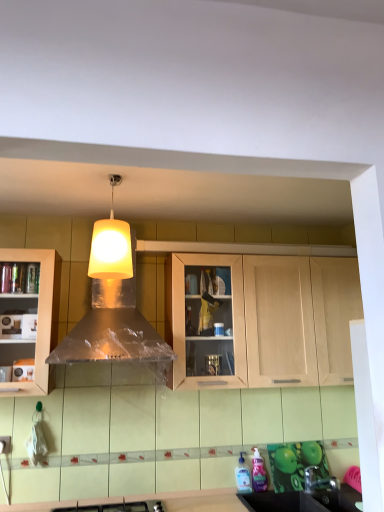
Question: Is light wood cabinet at center looking in the opposite direction of white matte lampshade at upper center?

Choices:
 (A) yes
 (B) no

Answer: (B)

Question: From a real-world perspective, is light wood cabinet at center positioned under white matte lampshade at upper center based on gravity?

Choices:
 (A) no
 (B) yes

Answer: (B)

Question: From the image's perspective, is light wood cabinet at center on white matte lampshade at upper center?

Choices:
 (A) yes
 (B) no

Answer: (B)

Question: Is light wood cabinet at center not near white matte lampshade at upper center?

Choices:
 (A) no
 (B) yes

Answer: (A)

Question: Considering the relative sizes of light wood cabinet at center and white matte lampshade at upper center in the image provided, is light wood cabinet at center wider than white matte lampshade at upper center?

Choices:
 (A) yes
 (B) no

Answer: (A)

Question: Do you think metallic silver hood at center is within black plastic sink at lower right, or outside of it?

Choices:
 (A) outside
 (B) inside

Answer: (A)

Question: From their relative heights in the image, would you say metallic silver hood at center is taller or shorter than black plastic sink at lower right?

Choices:
 (A) short
 (B) tall

Answer: (B)

Question: In terms of width, does metallic silver hood at center look wider or thinner when compared to black plastic sink at lower right?

Choices:
 (A) thin
 (B) wide

Answer: (B)

Question: Considering the positions of metallic silver hood at center and black plastic sink at lower right in the image, is metallic silver hood at center bigger or smaller than black plastic sink at lower right?

Choices:
 (A) small
 (B) big

Answer: (B)

Question: Considering their positions, is satin nickel faucet at lower right located in front of or behind metallic silver hood at center?

Choices:
 (A) front
 (B) behind

Answer: (B)

Question: Visually, is satin nickel faucet at lower right positioned to the left or to the right of metallic silver hood at center?

Choices:
 (A) right
 (B) left

Answer: (A)

Question: Is satin nickel faucet at lower right taller or shorter than metallic silver hood at center?

Choices:
 (A) short
 (B) tall

Answer: (A)

Question: From a real-world perspective, is satin nickel faucet at lower right physically located above or below metallic silver hood at center?

Choices:
 (A) below
 (B) above

Answer: (A)

Question: Looking at the image, does satin nickel faucet at lower right seem bigger or smaller compared to white matte lampshade at upper center?

Choices:
 (A) small
 (B) big

Answer: (A)

Question: Considering the positions of satin nickel faucet at lower right and white matte lampshade at upper center in the image, is satin nickel faucet at lower right wider or thinner than white matte lampshade at upper center?

Choices:
 (A) wide
 (B) thin

Answer: (A)